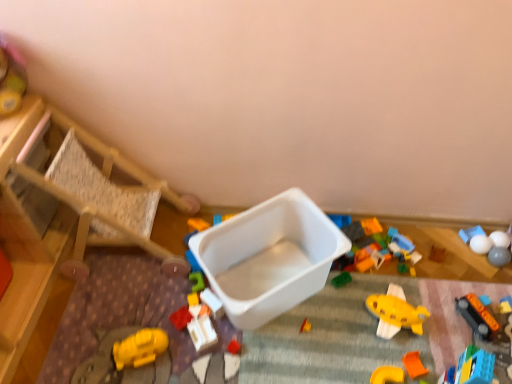
This screenshot has width=512, height=384. Identify the location of free space to the left of white glossy ball at upper right, the 11th toy in the left-to-right sequence. (433, 253).